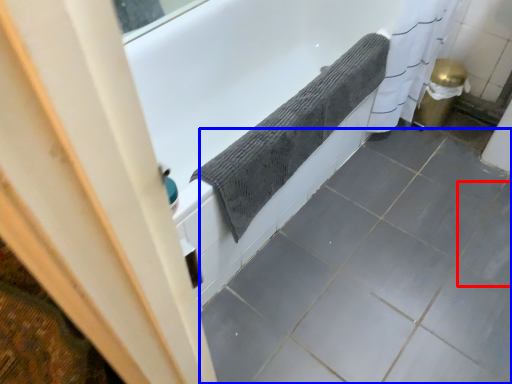
Question: Which of the following is the farthest to the observer, ceramic tile (highlighted by a red box) or ceramic tile (highlighted by a blue box)?

Choices:
 (A) ceramic tile
 (B) ceramic tile

Answer: (A)